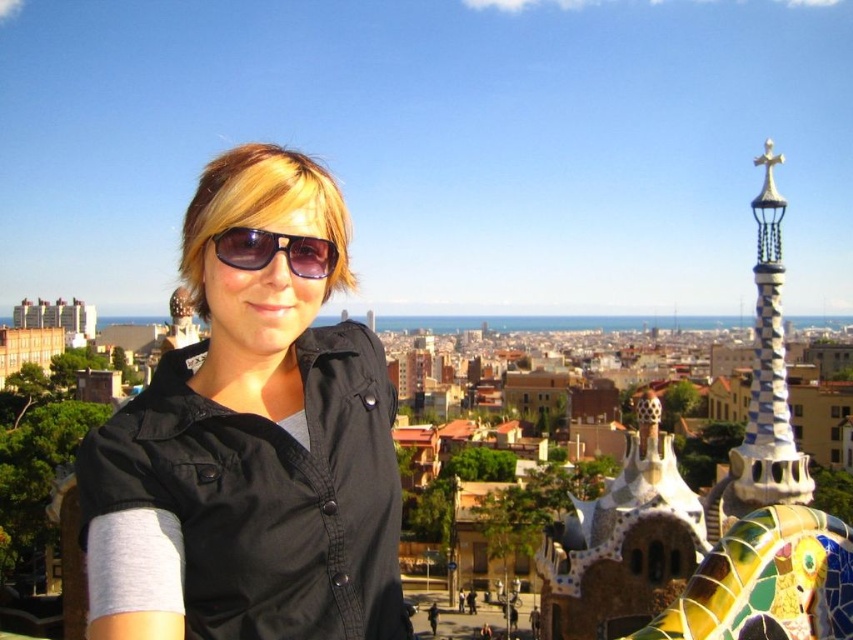
You are a photographer trying to capture the person in the scene. Since you want to focus on the person, you need to ensure their clothing items are visible. Given that the black matte shirt at center is larger than the matte black sunglasses at center, which clothing item will be more noticeable in your photo?

The black matte shirt at center is larger in size than the matte black sunglasses at center, so the black matte shirt at center will be more noticeable in the photo.

You are a photographer aiming to capture the multicolored mosaic spire at upper right in the background while focusing on the black matte shirt at center. Can you ensure the spire is in focus if you focus on the shirt?

The black matte shirt at center is closer to the viewer than the multicolored mosaic spire at upper right. If you focus on the shirt, the spire may not be in focus due to the depth of field limitations unless using a very small aperture.

You are a fashion designer observing the scene. You notice the black matte shirt at center and the matte black sunglasses at center. Which object has a greater width?

The black matte shirt at center has a greater width than the matte black sunglasses at center.